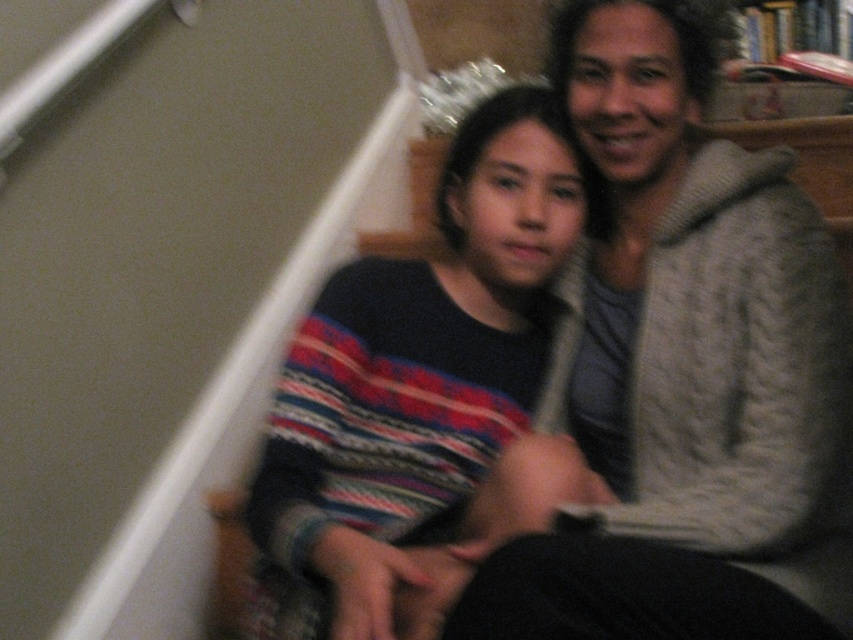
Question: Does knitted gray sweater at upper right appear under striped sweater at center?

Choices:
 (A) yes
 (B) no

Answer: (B)

Question: Among these objects, which one is farthest from the camera?

Choices:
 (A) knitted gray sweater at upper right
 (B) striped sweater at center

Answer: (B)

Question: Where is knitted gray sweater at upper right located in relation to striped sweater at center in the image?

Choices:
 (A) left
 (B) right

Answer: (B)

Question: Is knitted gray sweater at upper right positioned behind striped sweater at center?

Choices:
 (A) no
 (B) yes

Answer: (A)

Question: Which object appears closest to the camera in this image?

Choices:
 (A) knitted gray sweater at upper right
 (B) striped sweater at center

Answer: (A)